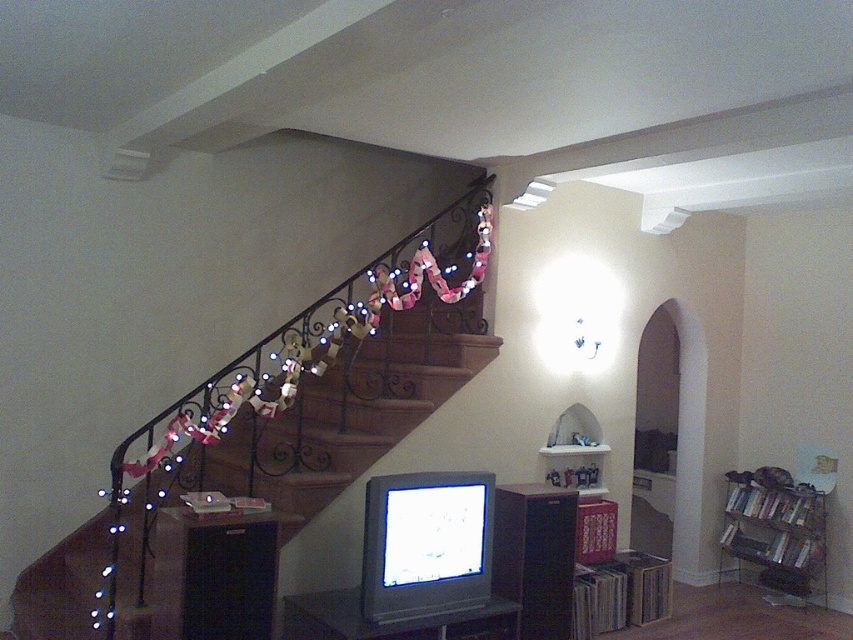
You are standing at the origin point of the coordinate system in the image. You need to move towards the wooden stairs at left. What are the coordinates you should head towards?

The wooden stairs at left are located at coordinates point (x=352, y=410). So you should move towards coordinates point (x=352, y=410).

You are moving a large painting that is 1.8 meters tall. You want to hang it on the wall so that it doesn not block either the wooden stairs at left or the metallic silver bookshelf at lower right. Based on their positions, which object is closer to the floor and should you avoid blocking?

The metallic silver bookshelf at lower right is closer to the floor than the wooden stairs at left, so you should avoid blocking the metallic silver bookshelf at lower right as it is lower and the painting might obstruct it if placed too low.